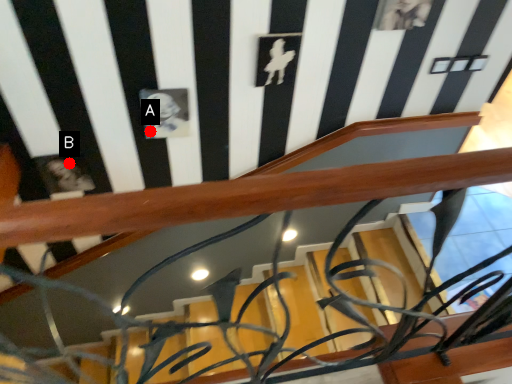
Question: Two points are circled on the image, labeled by A and B beside each circle. Which point is closer to the camera?

Choices:
 (A) A is closer
 (B) B is closer

Answer: (A)